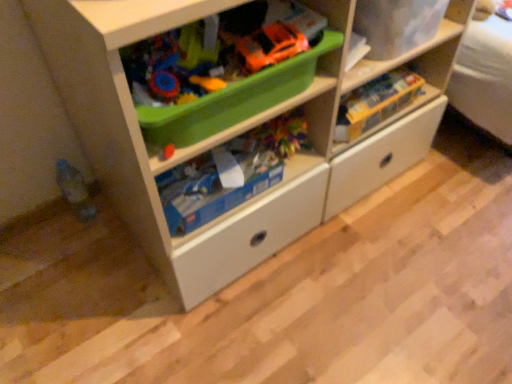
Question: From the image's perspective, would you say white matte chest of drawers at center is shown under matte plastic storage box at upper right?

Choices:
 (A) no
 (B) yes

Answer: (B)

Question: Does white matte chest of drawers at center have a smaller size compared to matte plastic storage box at upper right?

Choices:
 (A) no
 (B) yes

Answer: (A)

Question: Does white matte chest of drawers at center appear on the right side of matte plastic storage box at upper right?

Choices:
 (A) no
 (B) yes

Answer: (A)

Question: Does white matte chest of drawers at center appear on the left side of matte plastic storage box at upper right?

Choices:
 (A) no
 (B) yes

Answer: (B)

Question: Can you confirm if white matte chest of drawers at center is bigger than matte plastic storage box at upper right?

Choices:
 (A) no
 (B) yes

Answer: (B)

Question: From the image's perspective, relative to matte plastic toy at lower left, the first toy positioned from the left, is matte plastic storage box at upper right above or below?

Choices:
 (A) below
 (B) above

Answer: (B)

Question: In terms of size, does matte plastic storage box at upper right appear bigger or smaller than matte plastic toy at lower left, the third toy from the right?

Choices:
 (A) small
 (B) big

Answer: (B)

Question: Visually, is matte plastic storage box at upper right positioned to the left or to the right of matte plastic toy at lower left, the first toy positioned from the left?

Choices:
 (A) left
 (B) right

Answer: (B)

Question: Considering the positions of matte plastic storage box at upper right and matte plastic toy at lower left, the third toy from the right, in the image, is matte plastic storage box at upper right taller or shorter than matte plastic toy at lower left, the third toy from the right,?

Choices:
 (A) tall
 (B) short

Answer: (B)

Question: Is blue cardboard box at center, placed as the 2th toy when sorted from left to right, wider or thinner than yellow cardboard box at upper right, which appears as the first toy when viewed from the right?

Choices:
 (A) thin
 (B) wide

Answer: (B)

Question: From the image's perspective, is blue cardboard box at center, the 2th toy when ordered from right to left, positioned above or below yellow cardboard box at upper right, which appears as the first toy when viewed from the right?

Choices:
 (A) below
 (B) above

Answer: (A)

Question: In terms of size, does blue cardboard box at center, the 2th toy when ordered from right to left, appear bigger or smaller than yellow cardboard box at upper right, which appears as the first toy when viewed from the right?

Choices:
 (A) big
 (B) small

Answer: (A)

Question: Is blue cardboard box at center, placed as the 2th toy when sorted from left to right, taller or shorter than yellow cardboard box at upper right, which appears as the first toy when viewed from the right?

Choices:
 (A) tall
 (B) short

Answer: (A)

Question: Would you say matte plastic storage box at upper right is to the left or to the right of blue cardboard box at center, the 2th toy when ordered from right to left, in the picture?

Choices:
 (A) right
 (B) left

Answer: (A)

Question: Is matte plastic storage box at upper right bigger or smaller than blue cardboard box at center, placed as the 2th toy when sorted from left to right?

Choices:
 (A) big
 (B) small

Answer: (A)